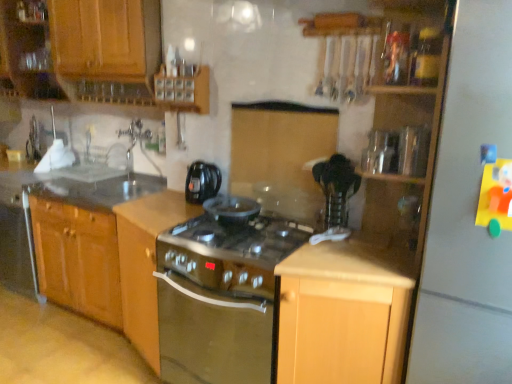
Locate an element on the screen. The width and height of the screenshot is (512, 384). vacant space in front of black plastic kettle at center is located at coordinates (181, 211).